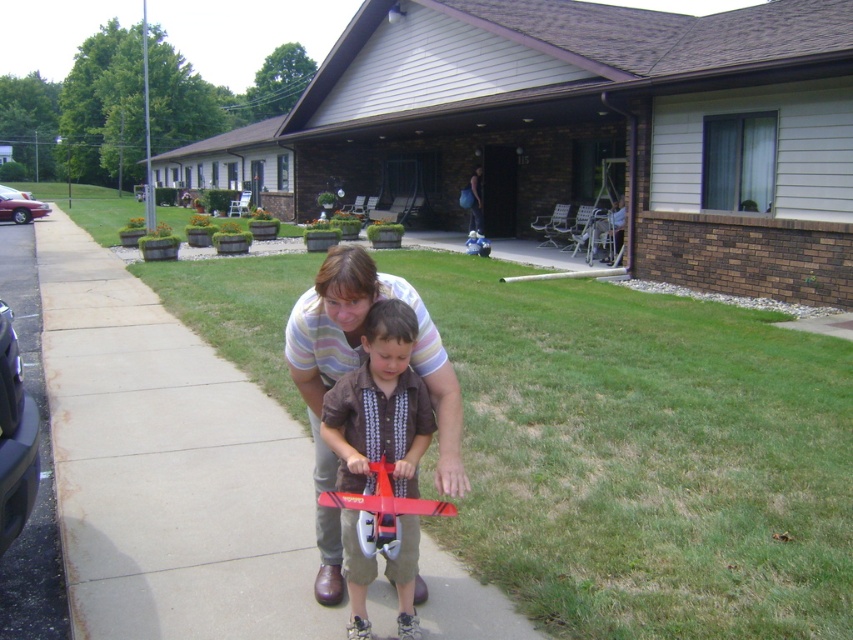
Question: Estimate the real-world distances between objects in this image. Which object is closer to the smooth concrete sidewalk at center?

Choices:
 (A) metallic red toy car at left
 (B) shiny red airplane at center

Answer: (B)

Question: Estimate the real-world distances between objects in this image. Which object is farther from the smooth concrete sidewalk at center?

Choices:
 (A) metallic red toy car at left
 (B) matte brown shirt at center
 (C) shiny red airplane at center

Answer: (A)

Question: Can you confirm if shiny red airplane at center is thinner than metallic red toy car at left?

Choices:
 (A) yes
 (B) no

Answer: (A)

Question: Is smooth concrete sidewalk at center to the left of matte brown shirt at center from the viewer's perspective?

Choices:
 (A) yes
 (B) no

Answer: (A)

Question: Does matte brown shirt at center have a larger size compared to metallic red toy car at left?

Choices:
 (A) yes
 (B) no

Answer: (B)

Question: Which point appears farthest from the camera in this image?

Choices:
 (A) (387, 540)
 (B) (404, 492)
 (C) (47, 259)
 (D) (9, 209)

Answer: (D)